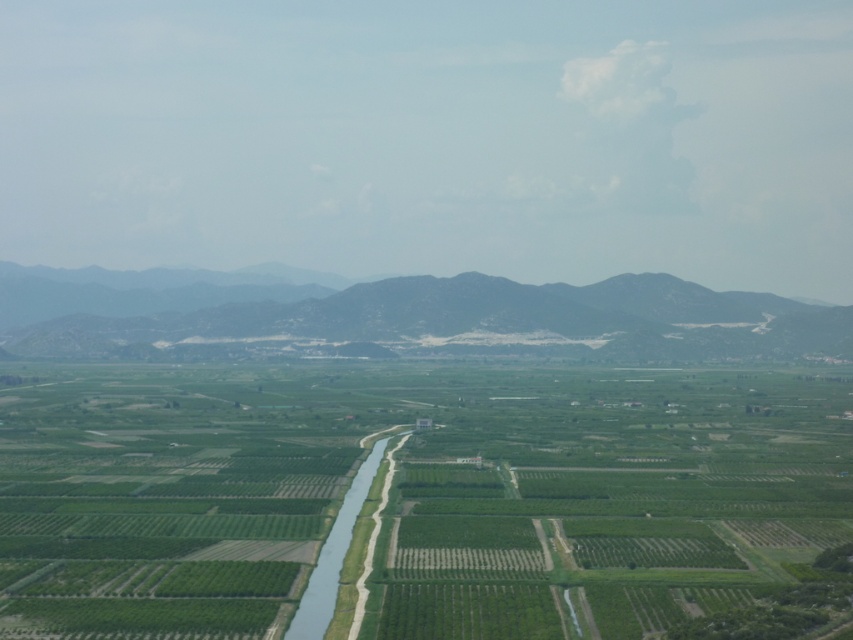
Is green grassy fields at center bigger than green grassy waterway at center?

Indeed, green grassy fields at center has a larger size compared to green grassy waterway at center.

Is the position of green grassy fields at center more distant than that of green grassy waterway at center?

No.

This screenshot has width=853, height=640. I want to click on green grassy fields at center, so click(412, 497).

Which of these two, green grassy fields at center or green textured mountain at center, stands taller?

green textured mountain at center

Is point (596, 580) more distant than point (102, 273)?

No, (596, 580) is in front of (102, 273).

Who is more forward, (801, 460) or (403, 332)?

Positioned in front is point (801, 460).

The width and height of the screenshot is (853, 640). Find the location of `green grassy fields at center`. green grassy fields at center is located at coordinates (412, 497).

Which is in front, point (428, 348) or point (334, 557)?

Point (334, 557)

Is green textured mountain at center taller than green grassy waterway at center?

Correct, green textured mountain at center is much taller as green grassy waterway at center.

Does point (587, 328) lie behind point (320, 556)?

Yes, it is behind point (320, 556).

Image resolution: width=853 pixels, height=640 pixels. Find the location of `green textured mountain at center`. green textured mountain at center is located at coordinates (408, 317).